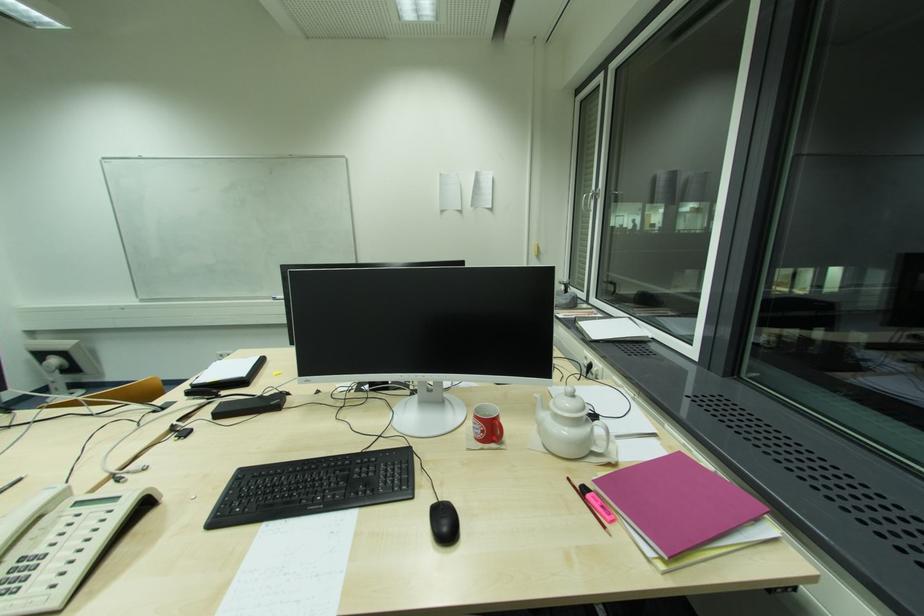
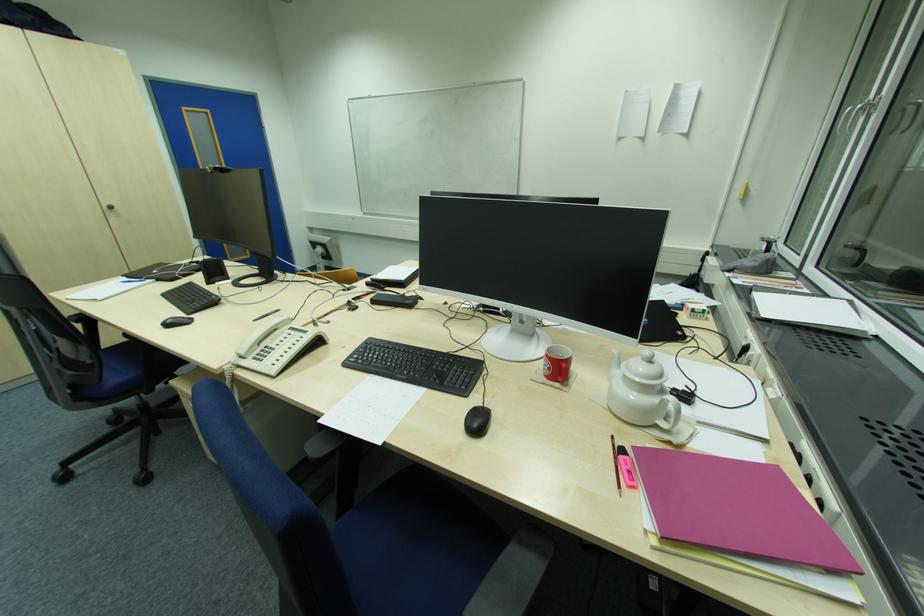
In the second image, find the point that corresponds to [484,432] in the first image.

(551, 370)